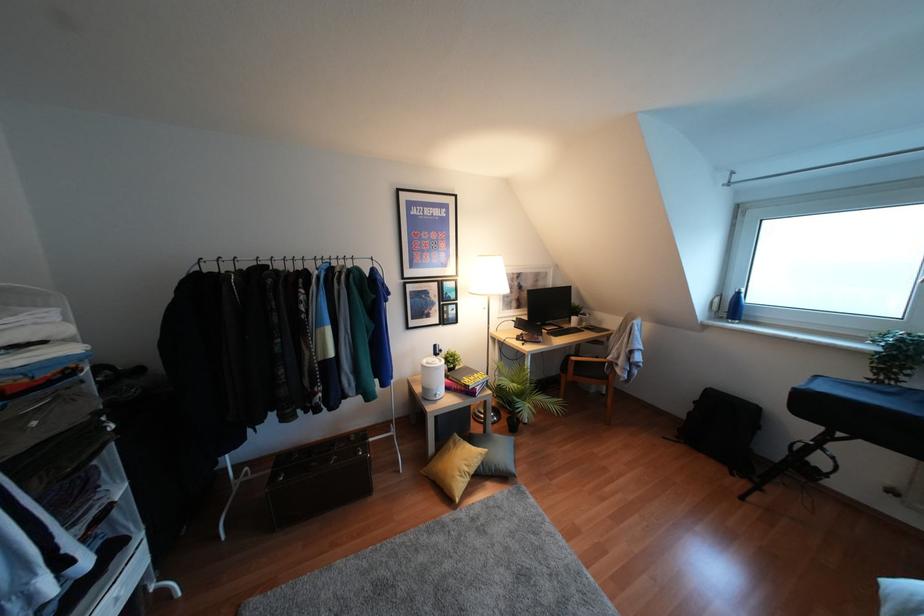
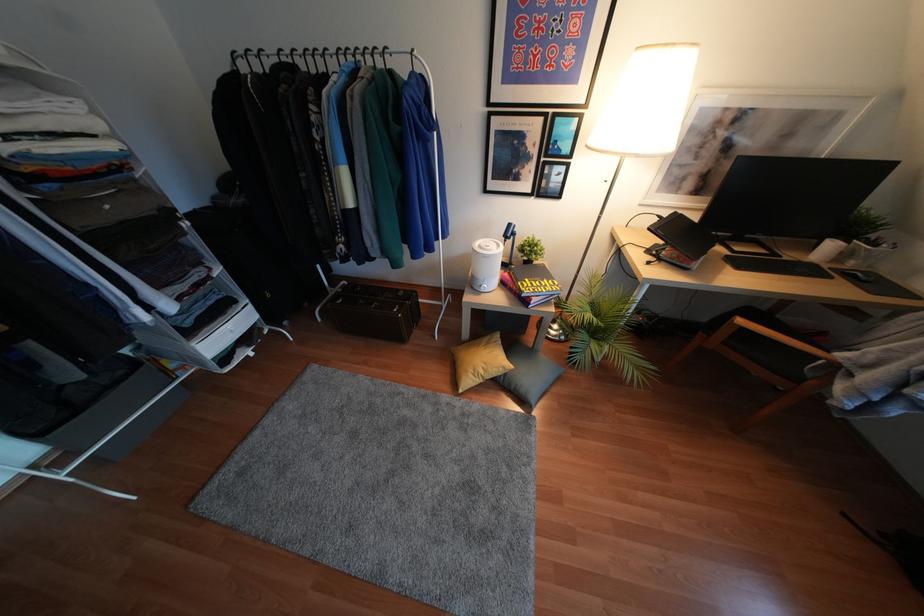
Where in the second image is the point corresponding to point 319,262 from the first image?

(342, 59)